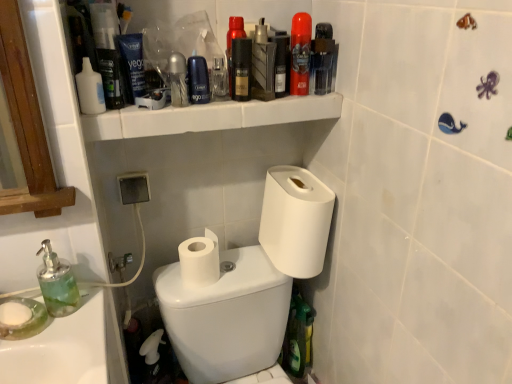
This screenshot has height=384, width=512. Identify the location of free spot to the right of white matte toilet paper at center, placed as the second toilet paper when sorted from right to left. (247, 274).